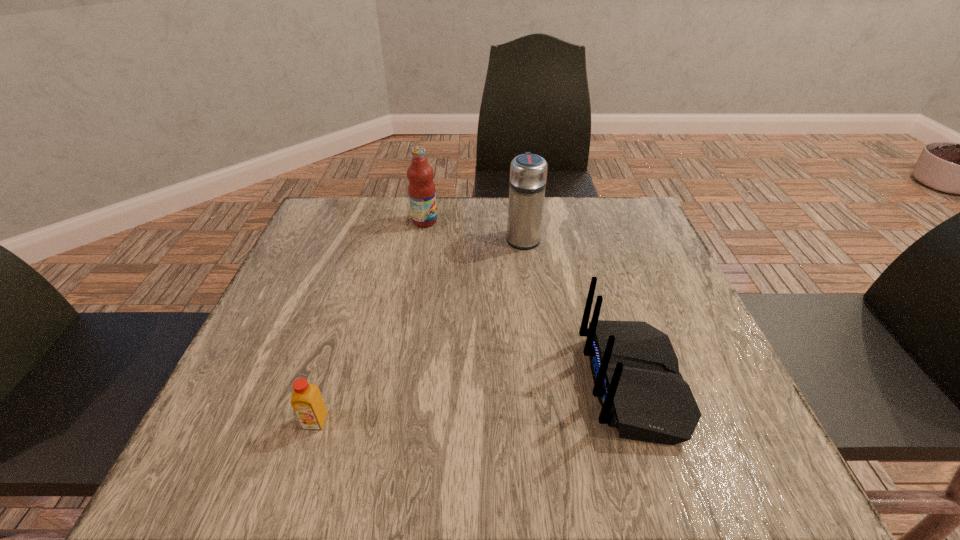
The image size is (960, 540). I want to click on thermos bottle, so click(x=528, y=172).

I want to click on the second object from left to right, so click(421, 189).

The height and width of the screenshot is (540, 960). I want to click on the third tallest object, so click(635, 370).

You are a GUI agent. You are given a task and a screenshot of the screen. Output one action in this format:
    pyautogui.click(x=<x>, y=<y>)
    Task: Click on the rightmost object
    This screenshot has width=960, height=540.
    Given the screenshot: What is the action you would take?
    pyautogui.click(x=635, y=370)

This screenshot has width=960, height=540. Identify the location of the leftmost object. (307, 402).

Locate an element on the screen. This screenshot has height=540, width=960. the shortest object is located at coordinates (307, 402).

You are a GUI agent. You are given a task and a screenshot of the screen. Output one action in this format:
    pyautogui.click(x=<x>, y=<y>)
    Task: Click on the vacant space situated 0.070m with a handle on the side of the third object from left to right
    
    Given the screenshot: What is the action you would take?
    pyautogui.click(x=519, y=211)

The image size is (960, 540). What are the coordinates of `vacant region located with a handle on the side of the third object from left to right` in the screenshot? It's located at (519, 211).

The image size is (960, 540). In order to click on free space located with a handle on the side of the third object from left to right in this screenshot , I will do `click(519, 209)`.

Locate an element on the screen. vacant space located on the front label of the fruit juice is located at coordinates (471, 221).